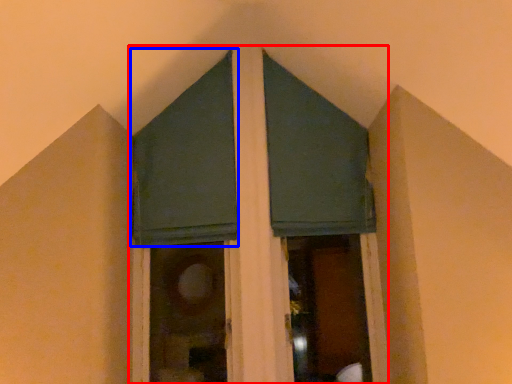
Question: Which object appears closest to the camera in this image, bay window (highlighted by a red box) or window screen (highlighted by a blue box)?

Choices:
 (A) bay window
 (B) window screen

Answer: (A)